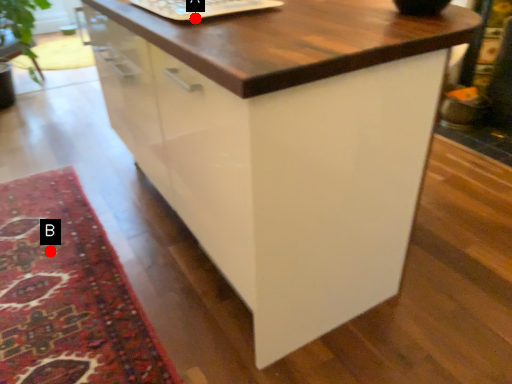
Question: Two points are circled on the image, labeled by A and B beside each circle. Which point is closer to the camera taking this photo?

Choices:
 (A) A is closer
 (B) B is closer

Answer: (A)